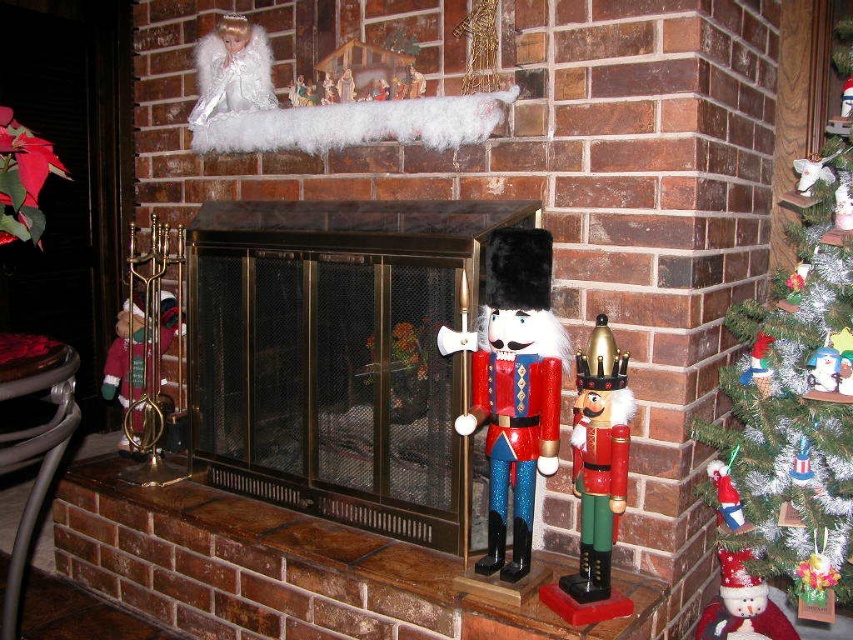
Question: Does frosted glass christmas tree at right appear under wooden nutcracker at center?

Choices:
 (A) yes
 (B) no

Answer: (B)

Question: Is metallic gold fireplace at center to the right of wooden nutcracker at right from the viewer's perspective?

Choices:
 (A) yes
 (B) no

Answer: (B)

Question: Does frosted glass christmas tree at right have a greater width compared to wooden nutcracker at right?

Choices:
 (A) yes
 (B) no

Answer: (A)

Question: Considering the real-world distances, which object is farthest from the wooden nutcracker at right?

Choices:
 (A) metallic gold fireplace at center
 (B) wooden nutcracker at center
 (C) frosted glass christmas tree at right

Answer: (A)

Question: Which of the following is the farthest from the observer?

Choices:
 (A) (744, 376)
 (B) (511, 365)
 (C) (521, 208)

Answer: (A)

Question: Among these objects, which one is nearest to the camera?

Choices:
 (A) frosted glass christmas tree at right
 (B) wooden nutcracker at right
 (C) wooden nutcracker at center

Answer: (B)